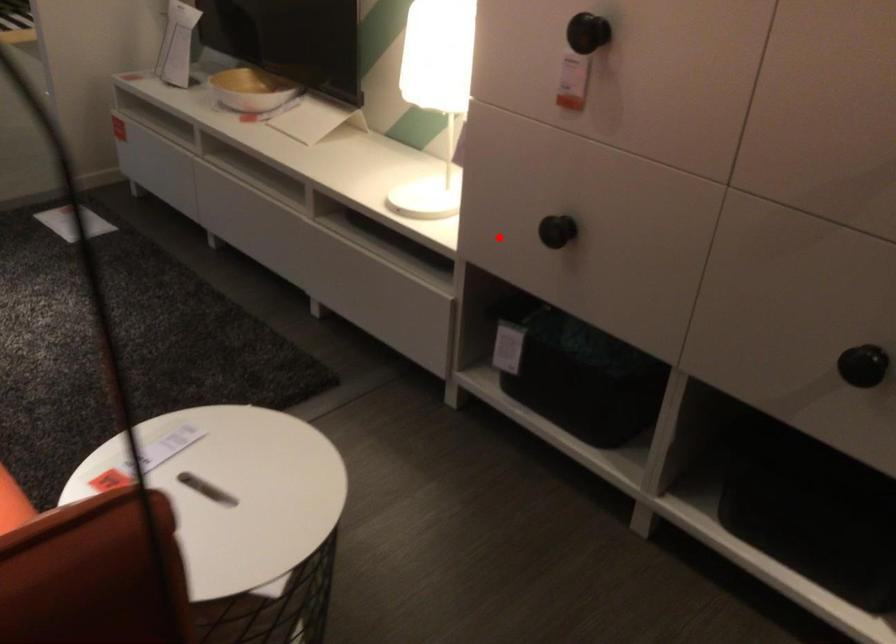
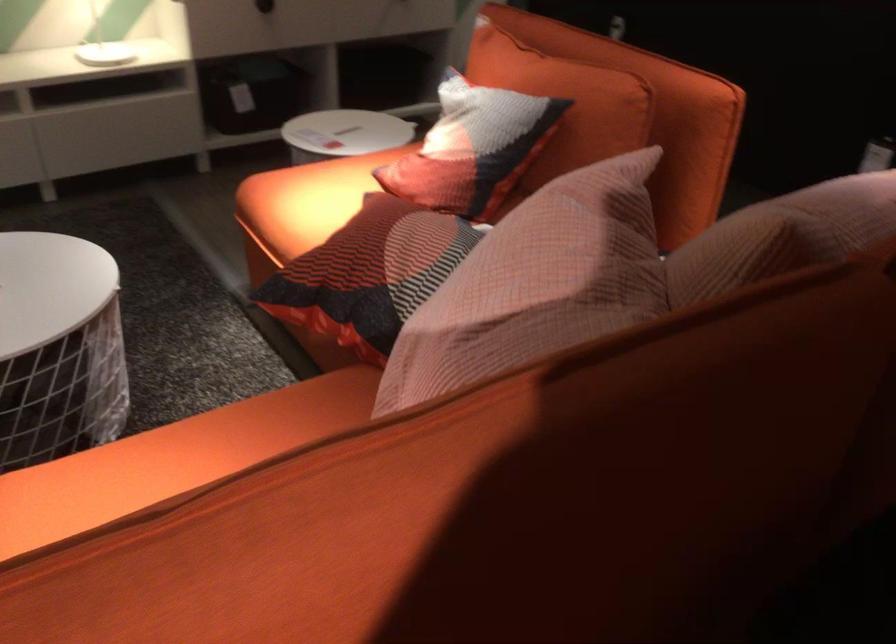
Question: I am providing you with two images of the same scene from different viewpoints. Image1 has a red point marked. In image2, the corresponding 3D location appears at what relative position? Reply with the corresponding letter.

Choices:
 (A) Closer
 (B) Farther

Answer: (B)